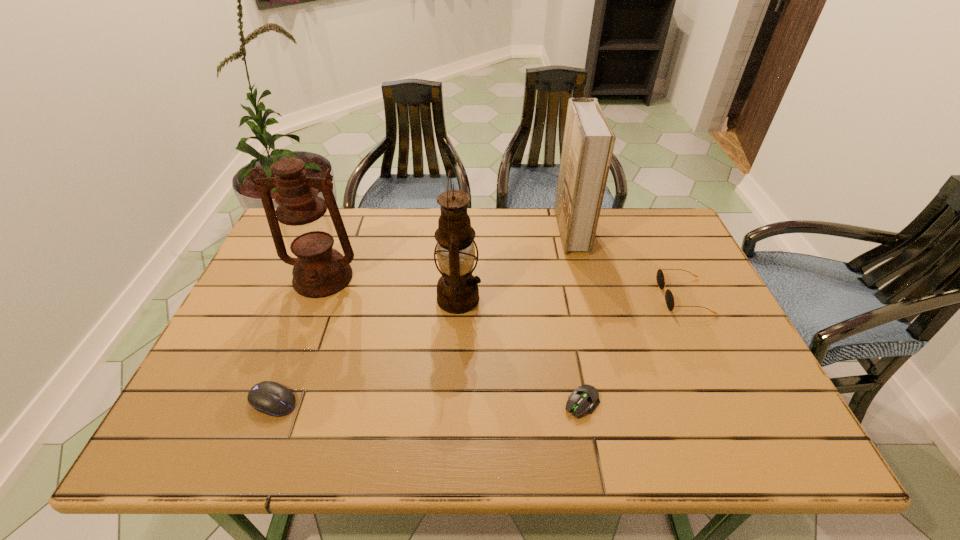
This screenshot has width=960, height=540. Identify the location of vacant area that lies between the farthest object and the left computer mouse. (422, 316).

Where is `empty space between the farthest object and the fourth object from right to left`? This screenshot has width=960, height=540. empty space between the farthest object and the fourth object from right to left is located at coordinates (515, 264).

This screenshot has height=540, width=960. I want to click on free spot between the rightmost object and the left oil lamp, so click(503, 287).

You are a GUI agent. You are given a task and a screenshot of the screen. Output one action in this format:
    pyautogui.click(x=<x>, y=<y>)
    Task: Click on the vacant space that is in between the rightmost object and the third object from left to right
    
    Given the screenshot: What is the action you would take?
    pyautogui.click(x=571, y=298)

This screenshot has width=960, height=540. In order to click on vacant region between the left oil lamp and the taller computer mouse in this screenshot , I will do point(299,340).

At what (x,y) coordinates should I click in order to perform the action: click on free space that is in between the third object from left to right and the right computer mouse. Please return your answer as a coordinate pair (x, y). The height and width of the screenshot is (540, 960). Looking at the image, I should click on (520, 351).

At what (x,y) coordinates should I click in order to perform the action: click on free space between the right oil lamp and the second shortest object. Please return your answer as a coordinate pair (x, y). The width and height of the screenshot is (960, 540). Looking at the image, I should click on (366, 350).

Identify the location of vacant space that is in between the right oil lamp and the right computer mouse. This screenshot has width=960, height=540. (520, 351).

You are a GUI agent. You are given a task and a screenshot of the screen. Output one action in this format:
    pyautogui.click(x=<x>, y=<y>)
    Task: Click on the object that is the fourth closest to the rightmost object
    
    Given the screenshot: What is the action you would take?
    pyautogui.click(x=319, y=271)

Identify which object is the fifth closest to the shortest object. Please provide its 2D coordinates. Your answer should be formatted as a tuple, i.e. [(x, y)], where the tuple contains the x and y coordinates of a point satisfying the conditions above.

[(319, 271)]